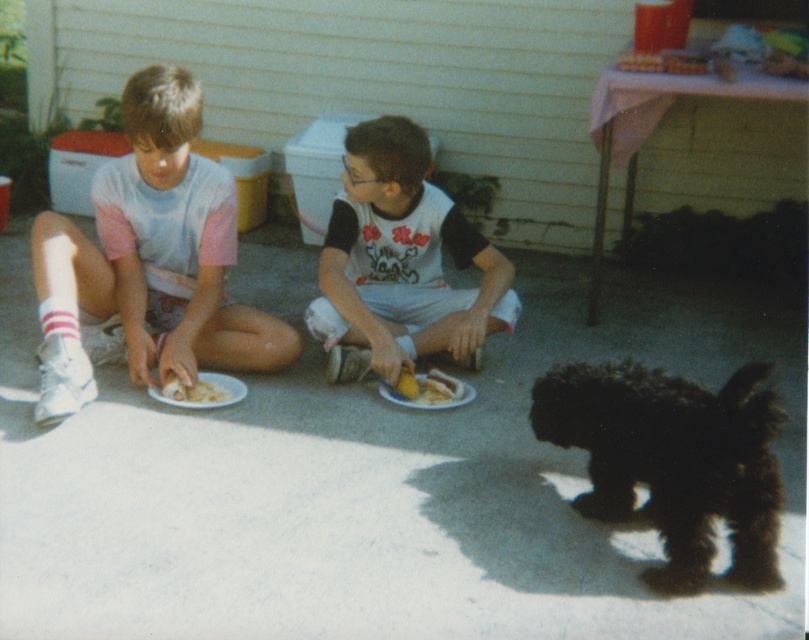
You are standing at the origin point in the image. The black fluffy dog at lower right is located at point (672, 461). If you want to throw a ball to the dog, which direction should you move relative to your current position?

The point (672, 461) where the black fluffy dog at lower right is located is to the lower right direction from the origin point. Therefore, you should move towards the lower right direction to throw the ball to the dog.

You are a photographer trying to capture both the matte white shirt at left and the white cotton shirt at center in a single frame. Based on their heights, which shirt should you position closer to the camera to ensure both are fully visible?

The matte white shirt at left is much taller than the white cotton shirt at center, so you should position the matte white shirt at left closer to the camera to ensure both are fully visible.